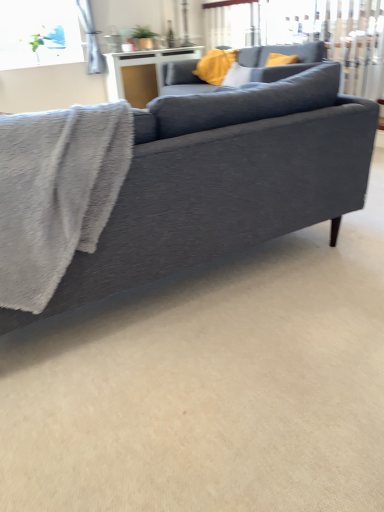
Question: Is yellow fabric pillow at upper center wider than white glossy table at upper center?

Choices:
 (A) yes
 (B) no

Answer: (A)

Question: Is yellow fabric pillow at upper center next to white glossy table at upper center and touching it?

Choices:
 (A) no
 (B) yes

Answer: (A)

Question: Can you confirm if yellow fabric pillow at upper center is taller than white glossy table at upper center?

Choices:
 (A) no
 (B) yes

Answer: (A)

Question: Can you confirm if yellow fabric pillow at upper center is positioned to the right of white glossy table at upper center?

Choices:
 (A) yes
 (B) no

Answer: (A)

Question: Can you confirm if yellow fabric pillow at upper center is smaller than white glossy table at upper center?

Choices:
 (A) no
 (B) yes

Answer: (B)

Question: Considering the positions of yellow fabric pillow at upper center and matte gray couch at center, which ranks as the 1th studio couch in bottom-to-top order, in the image, is yellow fabric pillow at upper center wider or thinner than matte gray couch at center, which ranks as the 1th studio couch in bottom-to-top order,?

Choices:
 (A) thin
 (B) wide

Answer: (A)

Question: Does point (226, 69) appear closer or farther from the camera than point (329, 87)?

Choices:
 (A) farther
 (B) closer

Answer: (A)

Question: From a real-world perspective, is yellow fabric pillow at upper center positioned above or below matte gray couch at center, which ranks as the 1th studio couch in front-to-back order?

Choices:
 (A) above
 (B) below

Answer: (A)

Question: From their relative heights in the image, would you say yellow fabric pillow at upper center is taller or shorter than matte gray couch at center, which ranks as the 1th studio couch in bottom-to-top order?

Choices:
 (A) tall
 (B) short

Answer: (B)

Question: From their relative heights in the image, would you say white glossy table at upper center is taller or shorter than matte gray couch at center, which ranks as the 1th studio couch in bottom-to-top order?

Choices:
 (A) short
 (B) tall

Answer: (A)

Question: From the image's perspective, is white glossy table at upper center located above or below matte gray couch at center, which is counted as the second studio couch, starting from the back?

Choices:
 (A) below
 (B) above

Answer: (B)

Question: Considering the positions of white glossy table at upper center and matte gray couch at center, which ranks as the 1th studio couch in bottom-to-top order, in the image, is white glossy table at upper center wider or thinner than matte gray couch at center, which ranks as the 1th studio couch in bottom-to-top order,?

Choices:
 (A) wide
 (B) thin

Answer: (B)

Question: In the image, is white glossy table at upper center positioned in front of or behind matte gray couch at center, which is counted as the second studio couch, starting from the back?

Choices:
 (A) front
 (B) behind

Answer: (B)

Question: Considering the positions of matte gray couch at upper center, which is counted as the 1th studio couch, starting from the top, and gray fuzzy bath towel at left in the image, is matte gray couch at upper center, which is counted as the 1th studio couch, starting from the top, wider or thinner than gray fuzzy bath towel at left?

Choices:
 (A) thin
 (B) wide

Answer: (B)

Question: From the image's perspective, is matte gray couch at upper center, the 1th studio couch viewed from the back, located above or below gray fuzzy bath towel at left?

Choices:
 (A) above
 (B) below

Answer: (A)